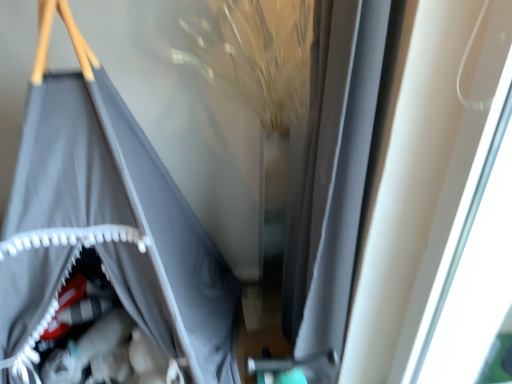
Question: Can you confirm if white plastic window at upper right is smaller than matte gray fabric at left?

Choices:
 (A) yes
 (B) no

Answer: (A)

Question: From the image's perspective, is white plastic window at upper right on top of matte gray fabric at left?

Choices:
 (A) no
 (B) yes

Answer: (A)

Question: Is white plastic window at upper right wider than matte gray fabric at left?

Choices:
 (A) yes
 (B) no

Answer: (B)

Question: Does white plastic window at upper right have a larger size compared to matte gray fabric at left?

Choices:
 (A) no
 (B) yes

Answer: (A)

Question: Is the surface of white plastic window at upper right in direct contact with matte gray fabric at left?

Choices:
 (A) no
 (B) yes

Answer: (A)

Question: Does white plastic window at upper right contain matte gray fabric at left?

Choices:
 (A) yes
 (B) no

Answer: (B)

Question: From a real-world perspective, is matte gray fabric at left positioned under white plastic window at upper right based on gravity?

Choices:
 (A) no
 (B) yes

Answer: (B)

Question: Is matte gray fabric at left positioned with its back to white plastic window at upper right?

Choices:
 (A) yes
 (B) no

Answer: (B)

Question: From the image's perspective, is matte gray fabric at left above white plastic window at upper right?

Choices:
 (A) yes
 (B) no

Answer: (A)

Question: Considering the relative sizes of matte gray fabric at left and white plastic window at upper right in the image provided, is matte gray fabric at left thinner than white plastic window at upper right?

Choices:
 (A) yes
 (B) no

Answer: (B)

Question: Does matte gray fabric at left turn towards white plastic window at upper right?

Choices:
 (A) yes
 (B) no

Answer: (B)

Question: Is the position of matte gray fabric at left more distant than that of white plastic window at upper right?

Choices:
 (A) no
 (B) yes

Answer: (B)

Question: Is point (453, 206) closer or farther from the camera than point (96, 203)?

Choices:
 (A) closer
 (B) farther

Answer: (A)